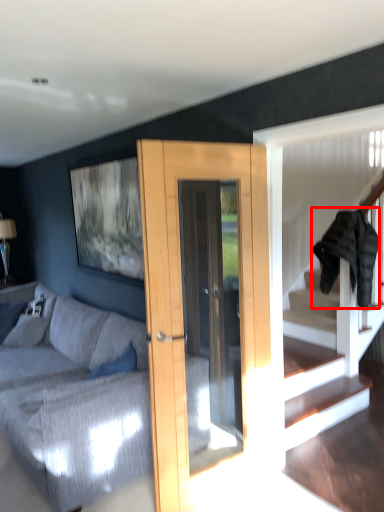
Question: From the image's perspective, what is the correct spatial positioning of clothe (annotated by the red box) in reference to studio couch?

Choices:
 (A) above
 (B) below

Answer: (A)